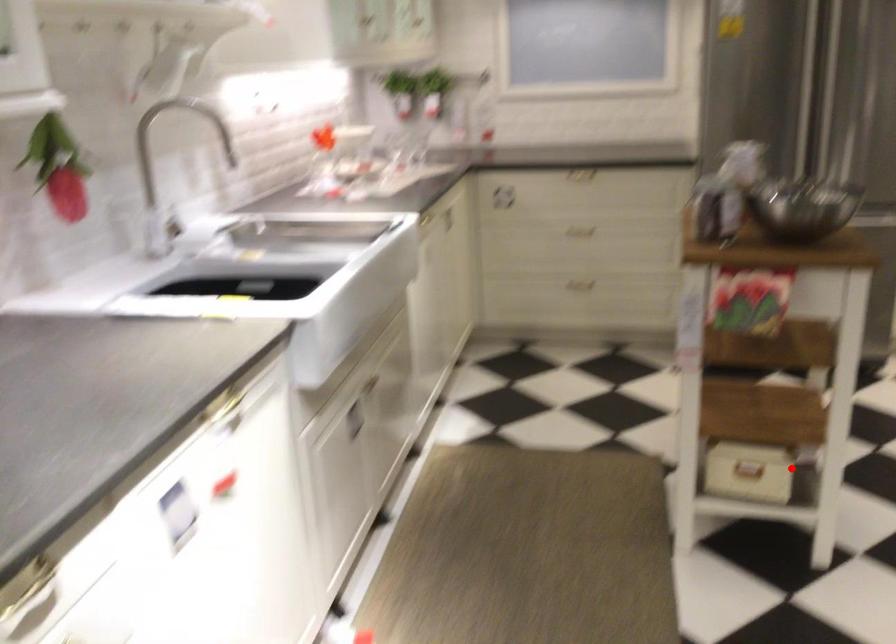
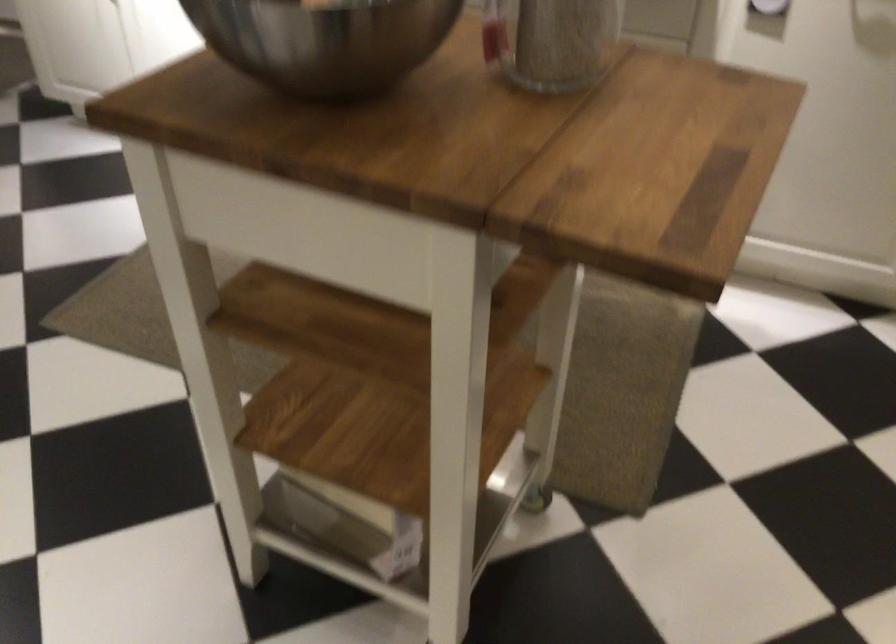
Question: I am providing you with two images of the same scene from different viewpoints. A red point is marked on the first image. Can you still see the location of the red point in image 2?

Choices:
 (A) Yes
 (B) No

Answer: (A)